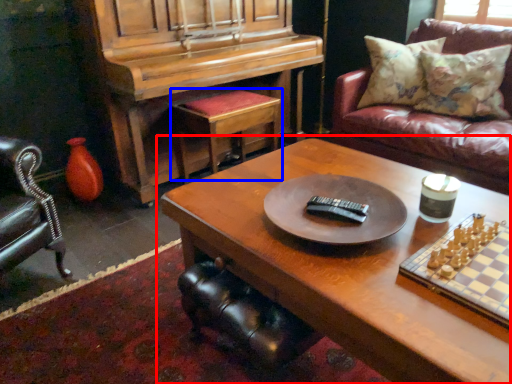
Question: Among these objects, which one is nearest to the camera, coffee table (highlighted by a red box) or stool (highlighted by a blue box)?

Choices:
 (A) coffee table
 (B) stool

Answer: (A)